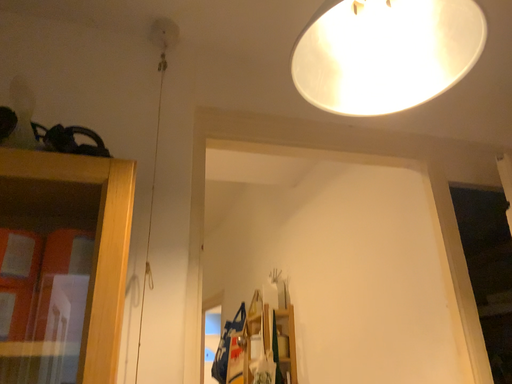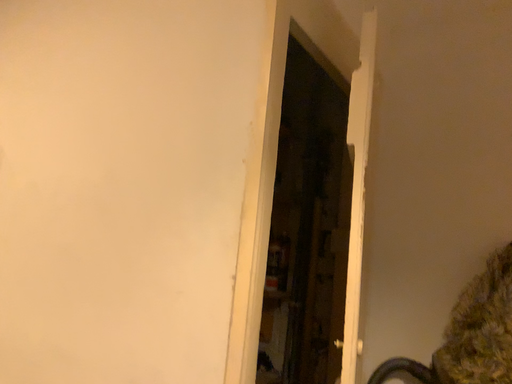
Question: Which way did the camera rotate in the video?

Choices:
 (A) rotated left
 (B) rotated right

Answer: (B)